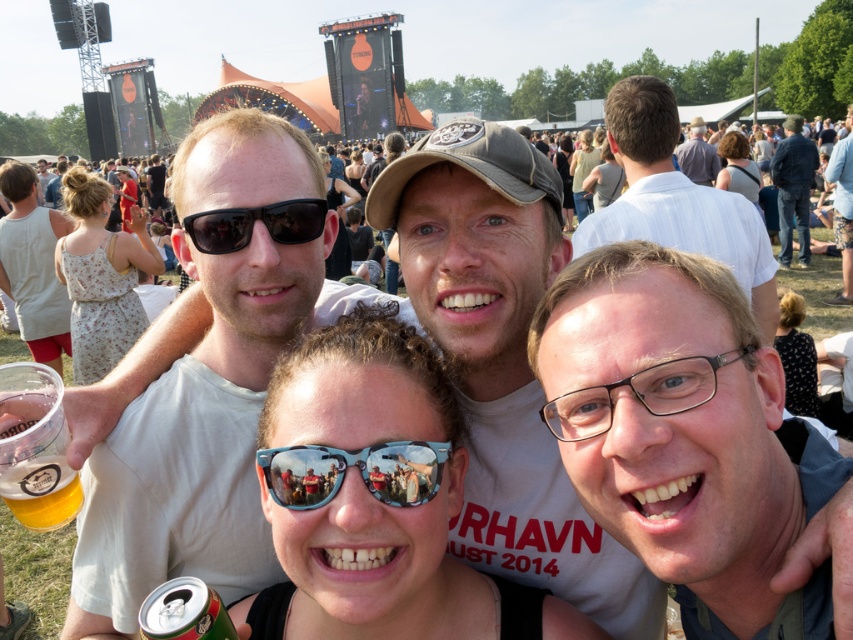
You are a photographer at the music festival. You want to take a photo of the black matte sunglasses at center from a distance where they appear 1.5 meters tall in the photo. Given that the sunglasses are 26.12 meters away, what is the minimum focal length your camera lens should have to capture them clearly without cropping?

The minimum focal length required can be calculated using the formula focal length equals the distance multiplied by the desired height divided by the sensor size. However, without knowing the sensor size, it is impossible to provide an exact value. Alternatively, a focal length of at least 26.12 meters divided by the ratio of the desired height to the actual height might work, but this requires more specific technical details.